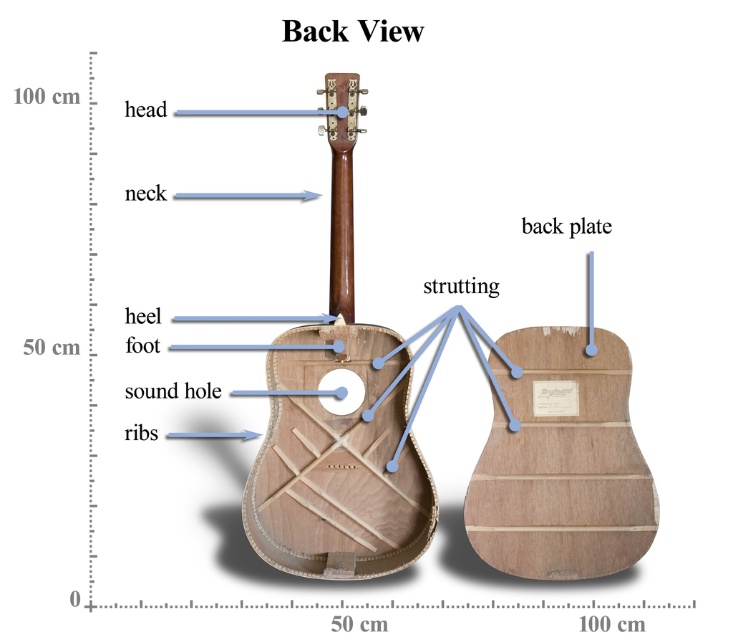
You are a luthier examining the acoustic guitar at center. You need to determine which part is bigger between the natural wood guitar at center and the natural wood strutting at center. Which one is larger?

The natural wood guitar at center has a larger size compared to natural wood strutting at center, so the natural wood guitar at center is bigger.

You are a guitar technician inspecting a guitar. You notice a point at coordinates [335,413] on the guitar. Based on the image provided, what material is present at this location?

The point [335,413] indicates natural wood guitar at center, so the material at this location is natural wood.

In the scene shown: You are standing in a music store and see the natural wood guitar at center. If you want to pick it up, will you be able to reach it without moving closer? Assume your outstretched hand can reach 1.2 meters.

The natural wood guitar at center is 1.28 meters away from the viewer. Since your outstretched hand can reach 1.2 meters, you cannot reach the guitar without moving closer because the distance is greater than your reach.